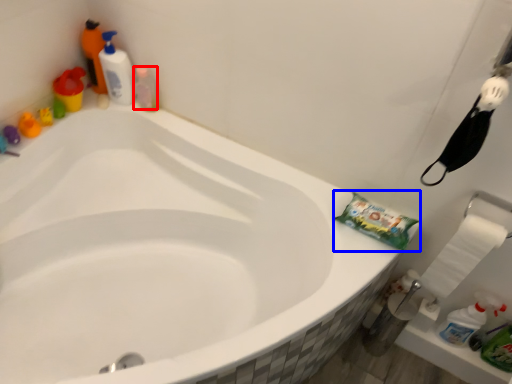
Question: Which point is closer to the camera, cleaning product (highlighted by a red box) or material (highlighted by a blue box)?

Choices:
 (A) cleaning product
 (B) material

Answer: (B)